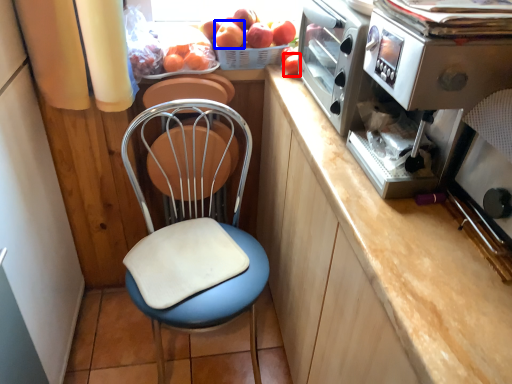
Question: Which object appears closest to the camera in this image, fruit (highlighted by a red box) or apple (highlighted by a blue box)?

Choices:
 (A) fruit
 (B) apple

Answer: (A)